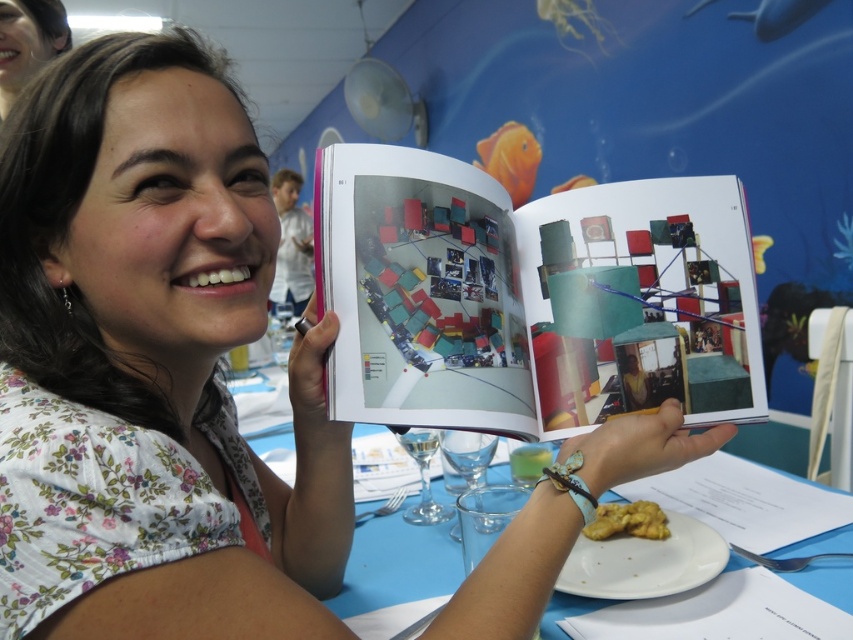
Question: Considering the real-world distances, which object is closest to the golden crumbly pastry at center?

Choices:
 (A) transparent glass at center
 (B) matte plastic book at center

Answer: (A)

Question: Which object appears closest to the camera in this image?

Choices:
 (A) transparent glass at center
 (B) golden crumbly pastry at center
 (C) blue plastic table at center
 (D) matte plastic book at center

Answer: (D)

Question: Is golden crumbly pastry at center positioned behind clear glass wine glass at lower center?

Choices:
 (A) yes
 (B) no

Answer: (B)

Question: Is blue plastic table at center behind transparent glass at center?

Choices:
 (A) yes
 (B) no

Answer: (B)

Question: Does blue plastic table at center come in front of clear glass wine glass at lower center?

Choices:
 (A) no
 (B) yes

Answer: (B)

Question: Which point is farther to the camera?

Choices:
 (A) transparent glass at center
 (B) matte plastic book at center
 (C) clear glass wine glass at lower center
 (D) blue plastic table at center

Answer: (C)